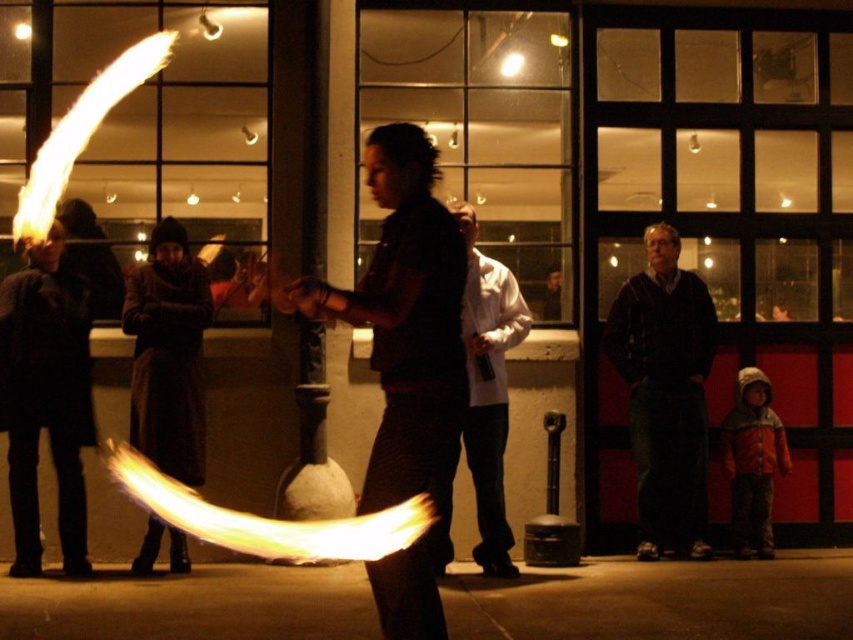
Consider the image. Can you confirm if matte black shirt at center is bigger than dark woolen coat at left?

Indeed, matte black shirt at center has a larger size compared to dark woolen coat at left.

Does point (375, 577) come in front of point (65, 424)?

Yes, point (375, 577) is closer to viewer.

Find the location of `matte black shirt at center`. matte black shirt at center is located at coordinates (405, 321).

Can you confirm if dark woolen coat at left is shorter than white matte jacket at center?

Yes.

Between dark woolen coat at left and white matte jacket at center, which one has less height?

With less height is dark woolen coat at left.

Is point (38, 573) more distant than point (500, 532)?

No, (38, 573) is closer to viewer.

The width and height of the screenshot is (853, 640). In order to click on dark woolen coat at left in this screenshot , I will do click(45, 397).

Which is more to the right, dark woolen coat at left or dark brown coat at left?

From the viewer's perspective, dark brown coat at left appears more on the right side.

Does point (22, 556) come farther from viewer compared to point (178, 300)?

No, it is in front of (178, 300).

I want to click on dark woolen coat at left, so click(x=45, y=397).